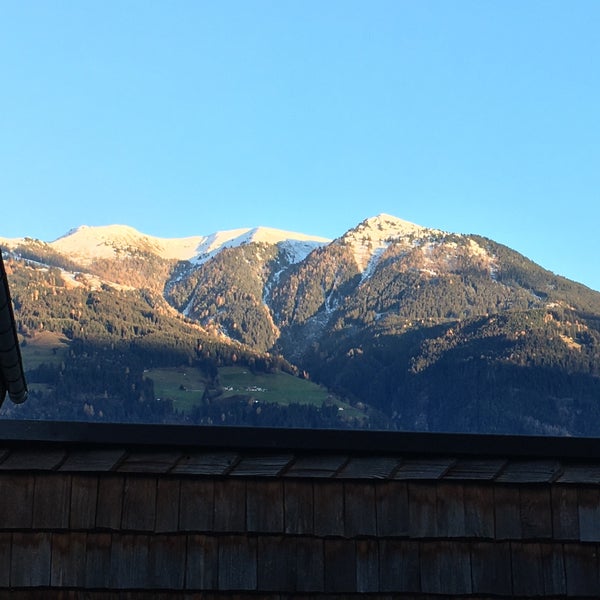
The width and height of the screenshot is (600, 600). I want to click on window, so click(60, 430).